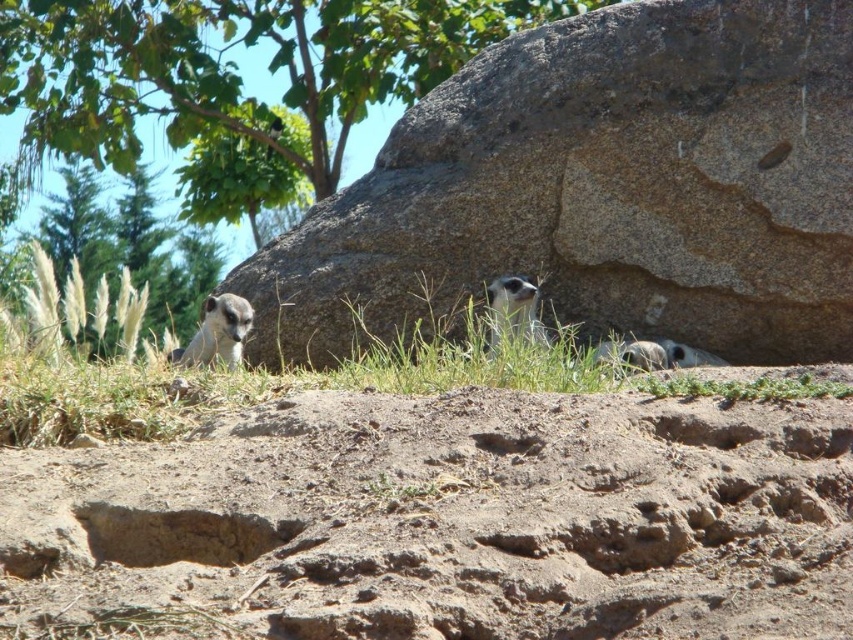
You are a meerkat in the image and want to climb the green leafy tree at upper center. Based on the coordinates provided, can you estimate how far the tree is from the meerkat? Please note that the meerkat is located at point 0.0, 0.0.

The green leafy tree at upper center is located at coordinates (234, 65). Since the meerkat is at (0, 0), the distance can be calculated using the Pythagorean theorem. The horizontal distance is 0.103 units and the vertical distance is 0.275 units. The straight line distance would be sqrt 0.103 squared plus 0.275 squared, which equals approximately 0.296 units. Therefore, the tree is approximately 0.296 units away from the meerkat.

You are a small animal trying to cross from the dull brown dirt at center to the smooth stone hole at upper right. Which path would require climbing upwards?

The path to the smooth stone hole at upper right requires climbing upwards because the dull brown dirt at center is taller than the smooth stone hole at upper right.